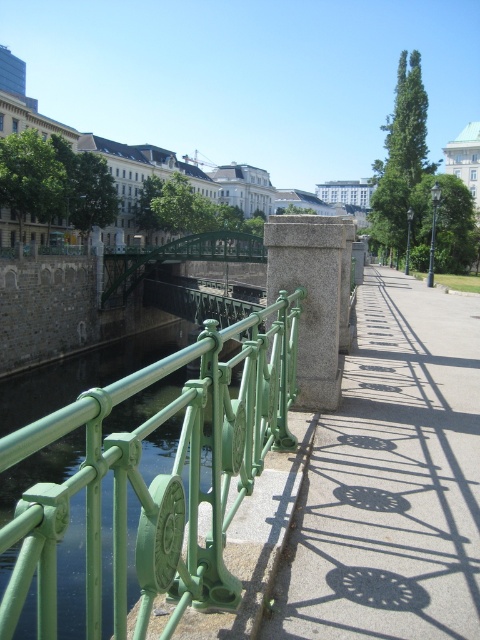
Question: Which object is closer to the camera taking this photo?

Choices:
 (A) green metal fence at center
 (B) green metal pedestrian bridge at center
 (C) smooth concrete sidewalk at center

Answer: (A)

Question: Is green metal fence at center bigger than green metal pedestrian bridge at center?

Choices:
 (A) yes
 (B) no

Answer: (B)

Question: Can you confirm if smooth concrete sidewalk at center is positioned below green metal fence at center?

Choices:
 (A) no
 (B) yes

Answer: (A)

Question: Which point appears closest to the camera in this image?

Choices:
 (A) (310, 490)
 (B) (118, 253)

Answer: (A)

Question: Which object is the closest to the green metal fence at center?

Choices:
 (A) smooth concrete sidewalk at center
 (B) green metal pedestrian bridge at center

Answer: (A)

Question: Is smooth concrete sidewalk at center thinner than green metal fence at center?

Choices:
 (A) no
 (B) yes

Answer: (A)